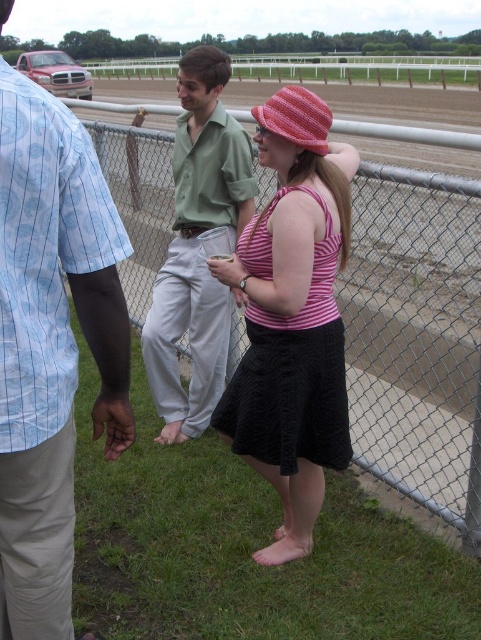
Question: Does metal chain-link fence at center appear on the right side of light blue striped shirt at left?

Choices:
 (A) no
 (B) yes

Answer: (B)

Question: Among these objects, which one is farthest from the camera?

Choices:
 (A) pink knitted hat at center
 (B) pink striped tank top at center

Answer: (A)

Question: In this image, where is pink striped tank top at center located relative to pink knitted hat at center?

Choices:
 (A) below
 (B) above

Answer: (A)

Question: Is pink striped tank top at center to the right of green cotton shirt at center from the viewer's perspective?

Choices:
 (A) no
 (B) yes

Answer: (B)

Question: Estimate the real-world distances between objects in this image. Which object is closer to the metal chain-link fence at center?

Choices:
 (A) pink striped tank top at center
 (B) green cotton shirt at center
 (C) pink knitted hat at center

Answer: (A)

Question: Which of the following is the farthest from the observer?

Choices:
 (A) (165, 380)
 (B) (343, 358)

Answer: (A)